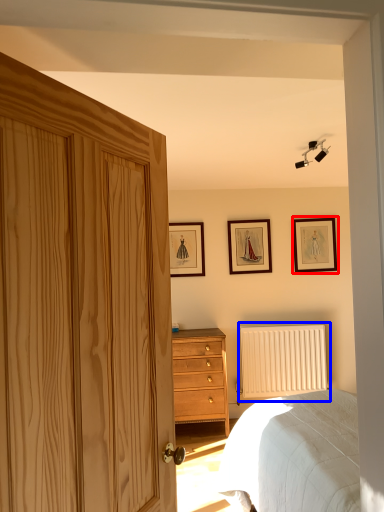
Question: Which point is closer to the camera, picture frame (highlighted by a red box) or radiator (highlighted by a blue box)?

Choices:
 (A) picture frame
 (B) radiator

Answer: (B)